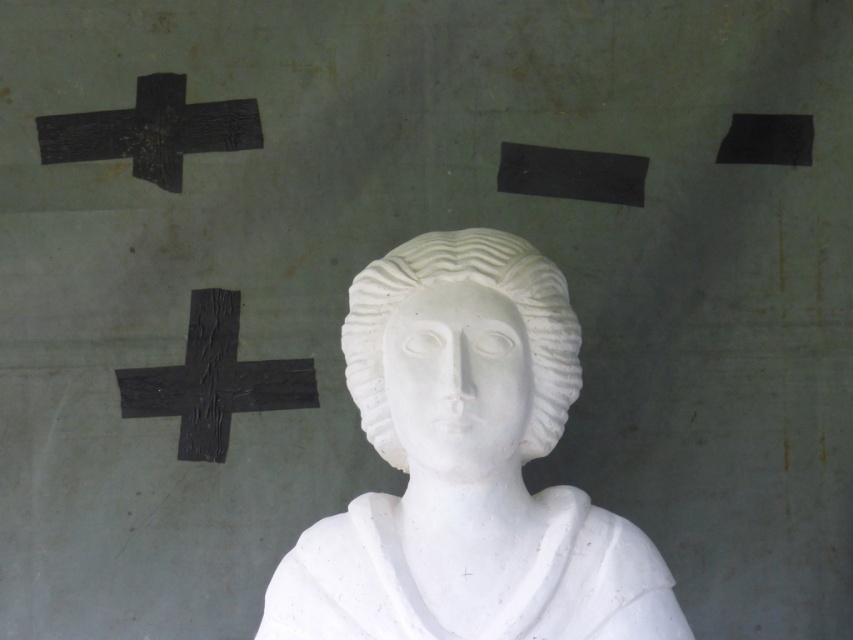
Where is `white marble bust at center`? Image resolution: width=853 pixels, height=640 pixels. white marble bust at center is located at coordinates (467, 468).

Consider the image. Is white marble bust at center to the left of white marble head at center from the viewer's perspective?

Yes, white marble bust at center is to the left of white marble head at center.

Is the position of white marble bust at center less distant than that of white marble head at center?

Yes, white marble bust at center is closer to the viewer.

The height and width of the screenshot is (640, 853). I want to click on white marble bust at center, so click(467, 468).

Does white marble head at center have a larger size compared to black crumpled paper at left?

Correct, white marble head at center is larger in size than black crumpled paper at left.

Which is more to the left, white marble head at center or black crumpled paper at left?

black crumpled paper at left is more to the left.

Is point (345, 353) farther from viewer compared to point (256, 403)?

That is False.

You are a GUI agent. You are given a task and a screenshot of the screen. Output one action in this format:
    pyautogui.click(x=<x>, y=<y>)
    Task: Click on the white marble head at center
    Image resolution: width=853 pixels, height=640 pixels.
    Given the screenshot: What is the action you would take?
    pyautogui.click(x=480, y=284)